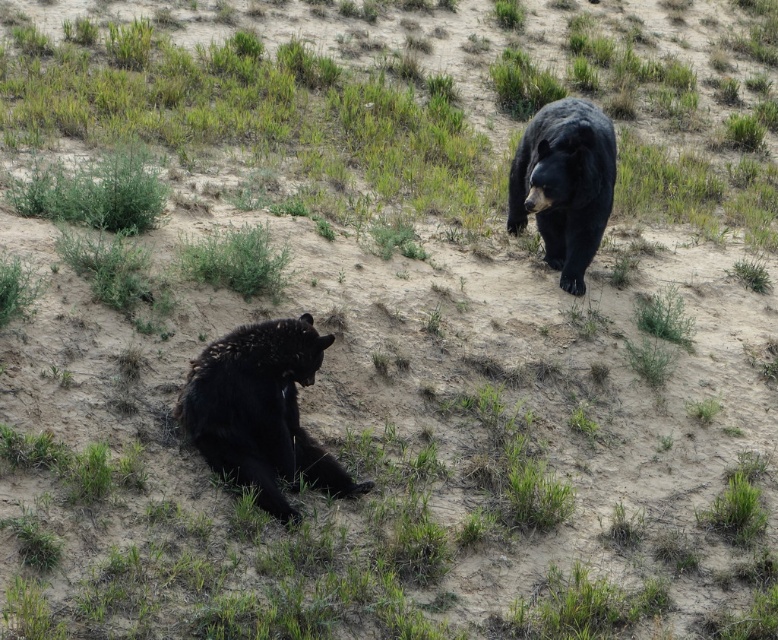
Does shiny black bear at lower left come behind shiny black bear at upper right?

No, shiny black bear at lower left is closer to the viewer.

Who is positioned more to the right, shiny black bear at lower left or shiny black bear at upper right?

shiny black bear at upper right

Between point (230, 435) and point (570, 204), which one is positioned behind?

The point (570, 204) is more distant.

Find the location of a particular element. shiny black bear at lower left is located at coordinates (260, 410).